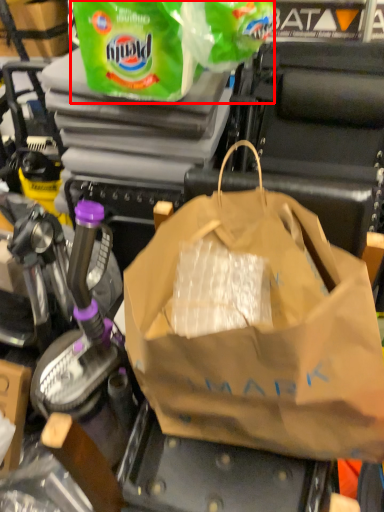
Question: From the image's perspective, where is plastic bag (annotated by the red box) located in relation to plastic bag in the image?

Choices:
 (A) above
 (B) below

Answer: (A)